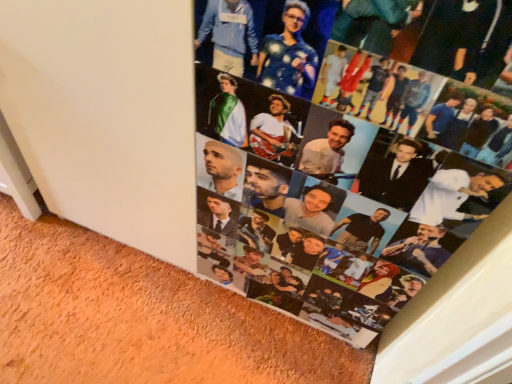
Question: Should I look upward or downward to see printed photo collage at center?

Choices:
 (A) up
 (B) down

Answer: (B)